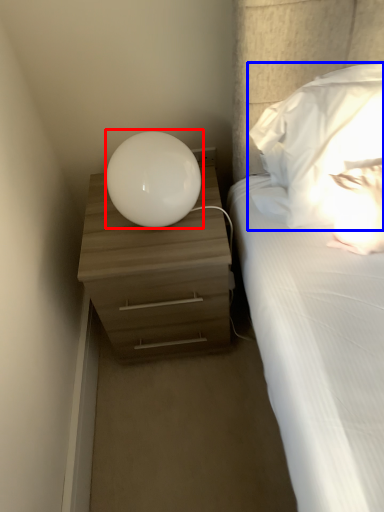
Question: Which object is closer to the camera taking this photo, table lamp (highlighted by a red box) or pillow (highlighted by a blue box)?

Choices:
 (A) table lamp
 (B) pillow

Answer: (B)